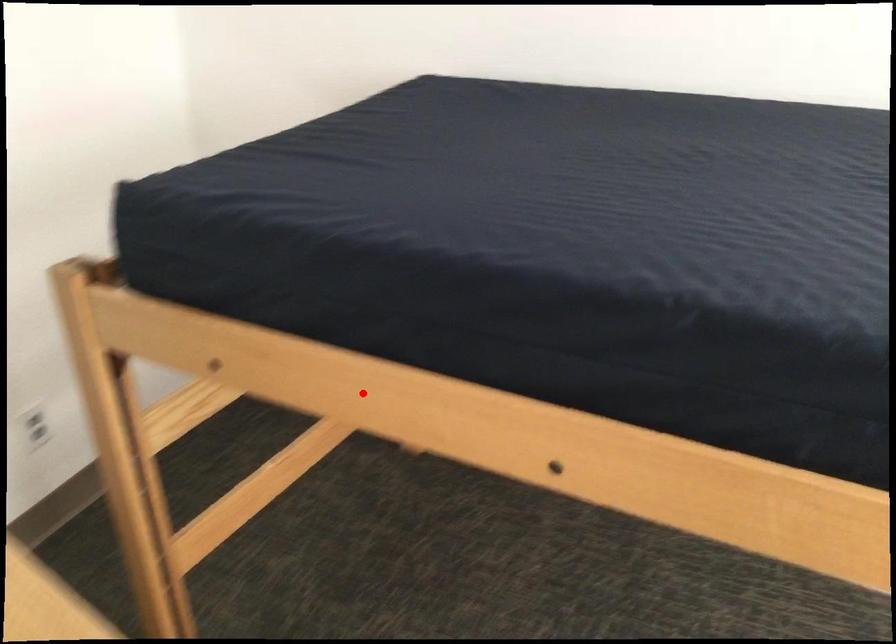
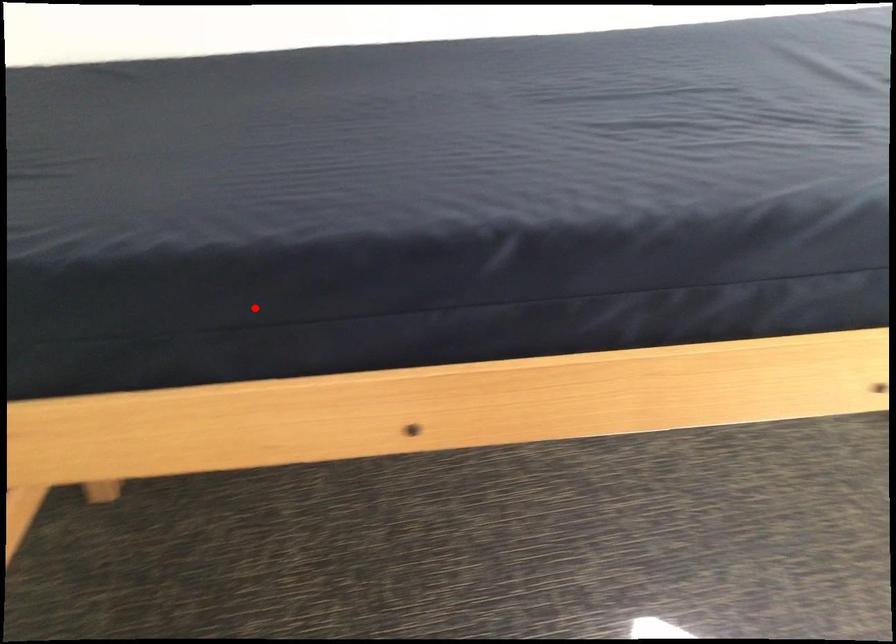
I am providing you with two images of the same scene from different viewpoints. A red point is marked on the first image and another point is marked on the second image. Do the highlighted points in image1 and image2 indicate the same real-world spot?

No